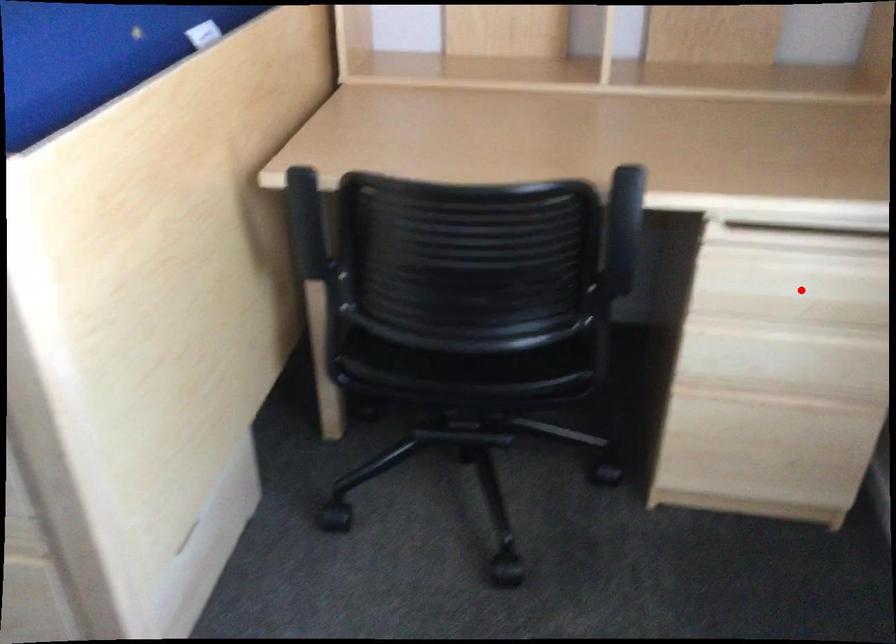
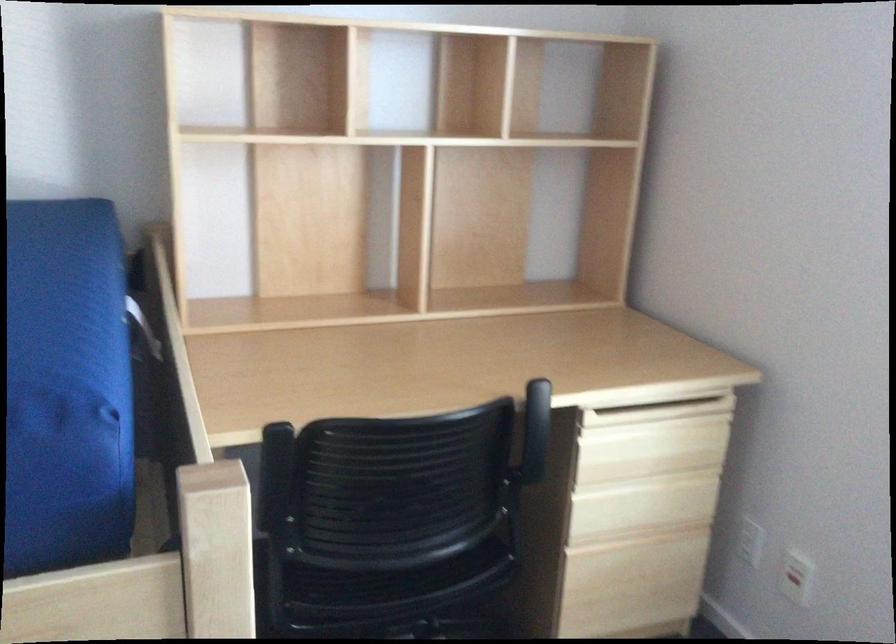
In the second image, find the point that corresponds to the highlighted location in the first image.

(650, 448)